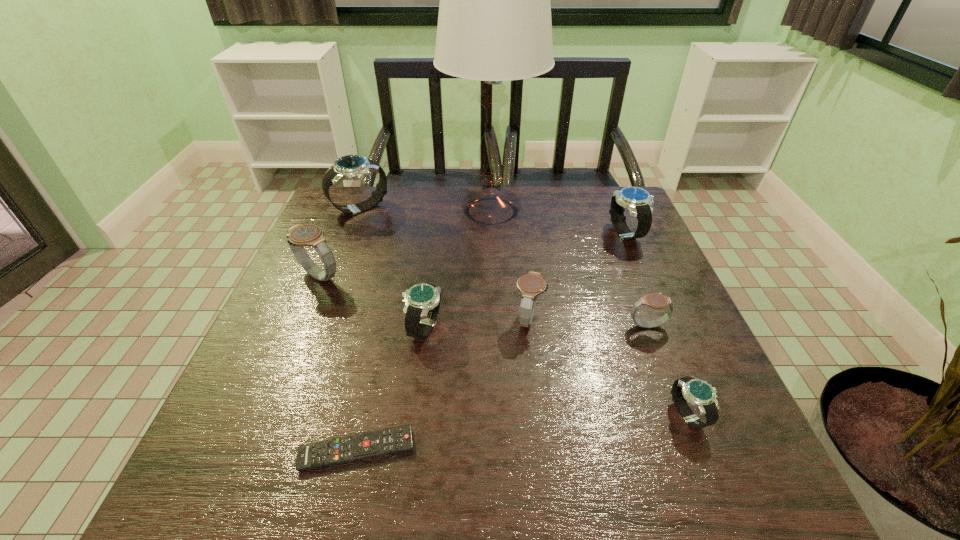
Locate an element on the screen. This screenshot has height=540, width=960. free space at the far edge of the desktop is located at coordinates (473, 224).

Image resolution: width=960 pixels, height=540 pixels. In order to click on vacant area at the near edge in this screenshot , I will do `click(489, 502)`.

Locate an element on the screen. This screenshot has width=960, height=540. free space at the left edge of the desktop is located at coordinates (333, 239).

Locate an element on the screen. The width and height of the screenshot is (960, 540). vacant region at the right edge of the desktop is located at coordinates (629, 286).

Image resolution: width=960 pixels, height=540 pixels. In order to click on vacant space at the far left corner of the desktop in this screenshot , I will do `click(375, 212)`.

This screenshot has height=540, width=960. In the image, there is a desktop. What are the coordinates of `vacant space at the near left corner` in the screenshot? It's located at (221, 488).

Find the location of a particular element. free point between the second smallest gray watch and the table lamp is located at coordinates (510, 265).

Image resolution: width=960 pixels, height=540 pixels. I want to click on free space that is in between the second smallest silver watch and the biggest silver watch, so click(393, 268).

The width and height of the screenshot is (960, 540). Find the location of `unoccupied area between the leftmost gray watch and the smallest silver watch`. unoccupied area between the leftmost gray watch and the smallest silver watch is located at coordinates (504, 346).

Locate an element on the screen. This screenshot has width=960, height=540. empty space that is in between the fifth watch from right to left and the leftmost silver watch is located at coordinates (393, 268).